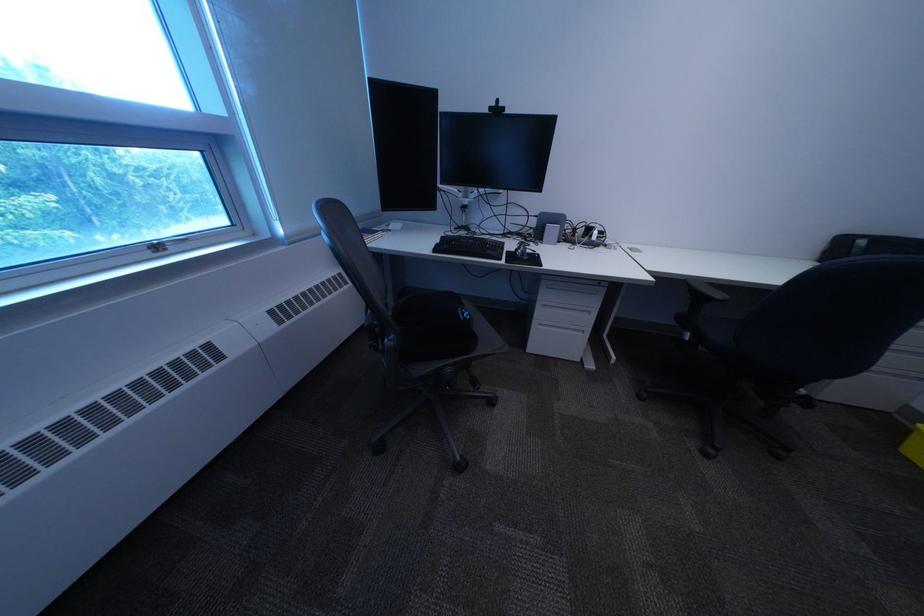
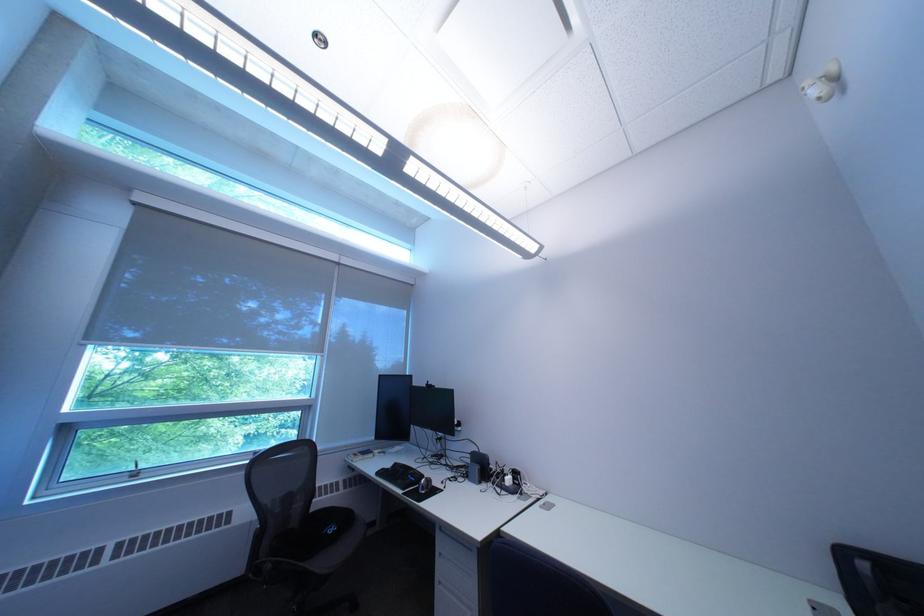
Where in the second image is the point corresponding to the point at 451,252 from the first image?

(393, 475)